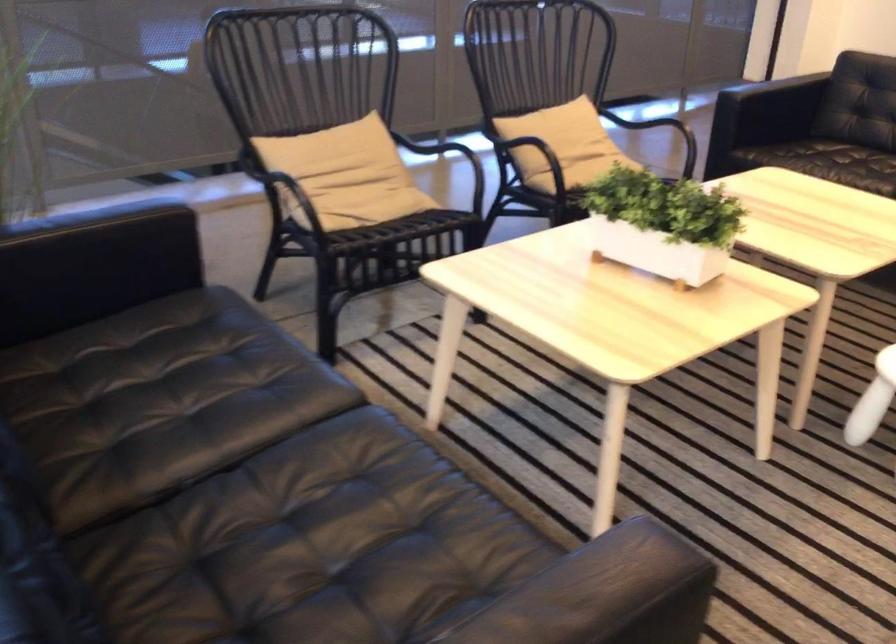
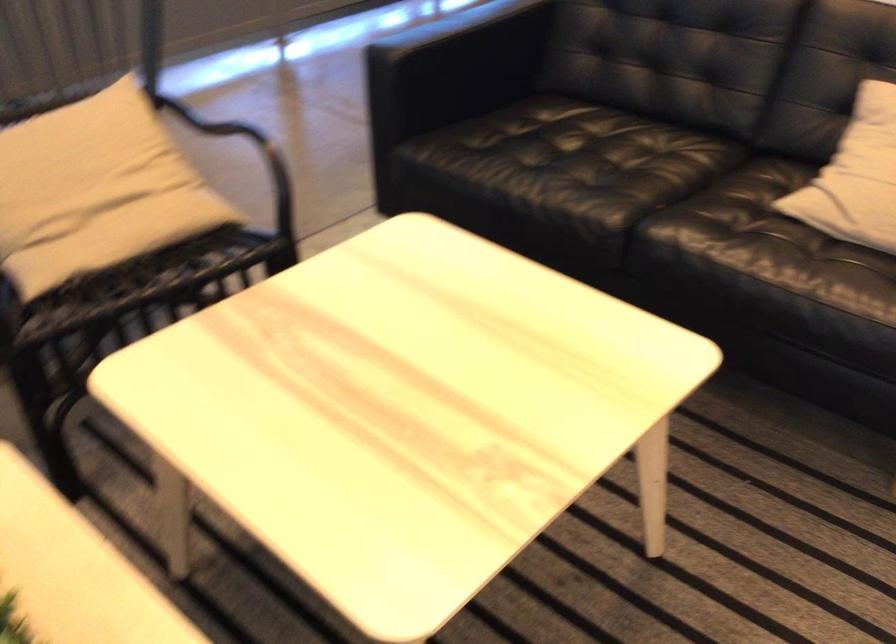
Which direction would the cameraman need to move to produce the second image?

The movement direction of the cameraman is right, forward.